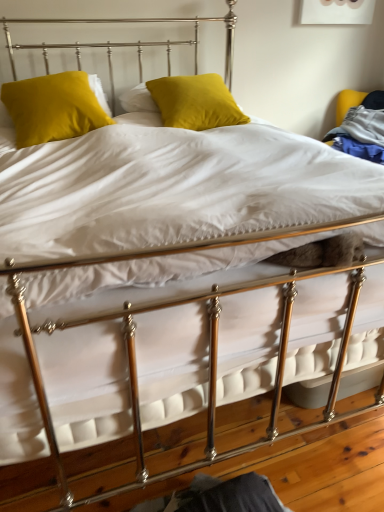
Question: Is point (56, 76) positioned closer to the camera than point (195, 97)?

Choices:
 (A) farther
 (B) closer

Answer: (B)

Question: From the image's perspective, is velvet yellow pillow at upper left, the 1th pillow from the left, positioned above or below satin yellow pillow at center, which ranks as the 2th pillow in left-to-right order?

Choices:
 (A) above
 (B) below

Answer: (B)

Question: From a real-world perspective, is velvet yellow pillow at upper left, which is the second pillow from right to left, above or below satin yellow pillow at center, which is counted as the 1th pillow, starting from the right?

Choices:
 (A) above
 (B) below

Answer: (B)

Question: Does point (226, 108) appear closer or farther from the camera than point (43, 89)?

Choices:
 (A) closer
 (B) farther

Answer: (B)

Question: Which is correct: satin yellow pillow at center, which ranks as the 2th pillow in left-to-right order, is inside velvet yellow pillow at upper left, which is the second pillow from right to left, or outside of it?

Choices:
 (A) inside
 (B) outside

Answer: (B)

Question: From the image's perspective, is satin yellow pillow at center, which ranks as the 2th pillow in left-to-right order, positioned above or below velvet yellow pillow at upper left, the 1th pillow from the left?

Choices:
 (A) below
 (B) above

Answer: (B)

Question: In terms of width, does satin yellow pillow at center, which ranks as the 2th pillow in left-to-right order, look wider or thinner when compared to velvet yellow pillow at upper left, which is the second pillow from right to left?

Choices:
 (A) wide
 (B) thin

Answer: (A)